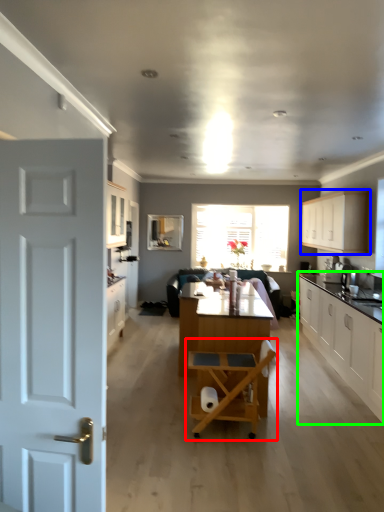
Question: Estimate the real-world distances between objects in this image. Which object is closer to chair (highlighted by a red box), cabinetry (highlighted by a blue box) or cabinetry (highlighted by a green box)?

Choices:
 (A) cabinetry
 (B) cabinetry

Answer: (B)